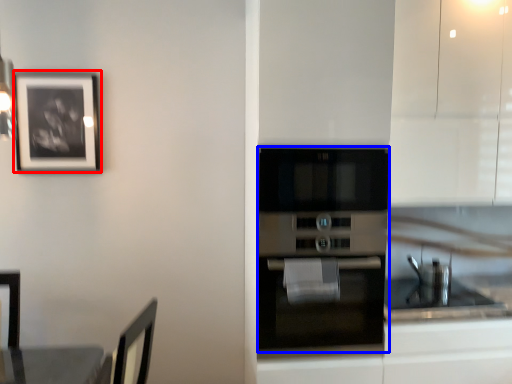
Question: Which of the following is the closest to the observer, picture frame (highlighted by a red box) or oven (highlighted by a blue box)?

Choices:
 (A) picture frame
 (B) oven

Answer: (B)